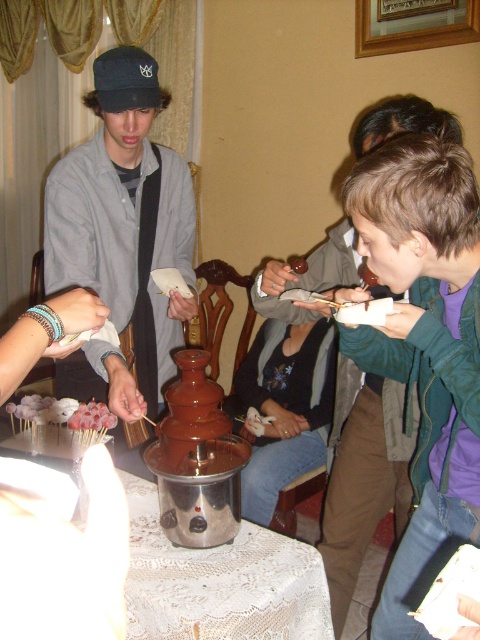
Question: Does matte black cap at center appear on the right side of white sugary skewers at lower left?

Choices:
 (A) yes
 (B) no

Answer: (A)

Question: From the image, what is the correct spatial relationship of green matte jacket at upper right in relation to matte black cap at center?

Choices:
 (A) right
 (B) left

Answer: (A)

Question: Estimate the real-world distances between objects in this image. Which object is farther from the matte black cap at center?

Choices:
 (A) green matte jacket at upper right
 (B) white sugary skewers at lower left

Answer: (A)

Question: Is matte black cap at center wider than white sugary skewers at lower left?

Choices:
 (A) no
 (B) yes

Answer: (A)

Question: Which object appears closest to the camera in this image?

Choices:
 (A) matte black cap at center
 (B) white sugary skewers at lower left
 (C) green matte jacket at upper right

Answer: (C)

Question: Which point is farther from the camera taking this photo?

Choices:
 (A) (342, 349)
 (B) (84, 417)

Answer: (B)